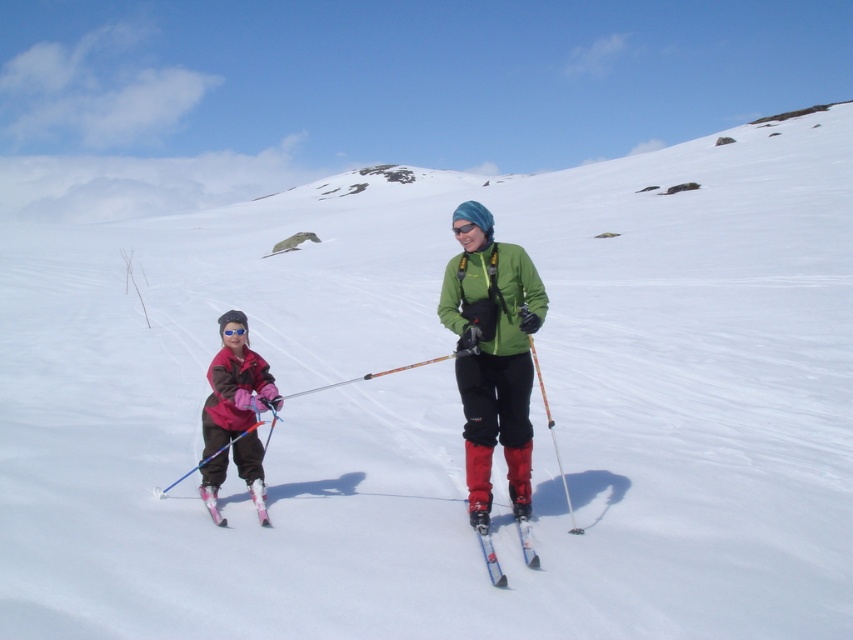
Does green matte jacket at center appear over metallic blue skis at center?

Indeed, green matte jacket at center is positioned over metallic blue skis at center.

How far apart are green matte jacket at center and metallic blue skis at center?

green matte jacket at center is 27.34 inches away from metallic blue skis at center.

Measure the distance between point (474, 260) and camera.

The distance of point (474, 260) from camera is 5.57 meters.

You are a GUI agent. You are given a task and a screenshot of the screen. Output one action in this format:
    pyautogui.click(x=<x>, y=<y>)
    Task: Click on the green matte jacket at center
    The height and width of the screenshot is (640, 853).
    Given the screenshot: What is the action you would take?
    pyautogui.click(x=492, y=353)

Which is in front, point (467, 236) or point (202, 422)?

Point (467, 236)

Measure the distance between green matte jacket at center and camera.

They are 17.11 feet apart.

Is point (502, 324) closer to viewer compared to point (256, 499)?

Yes, point (502, 324) is closer to viewer.

Where is `green matte jacket at center`? This screenshot has height=640, width=853. green matte jacket at center is located at coordinates (492, 353).

Which is in front, point (247, 422) or point (219, 518)?

Point (219, 518) is in front.

Identify the location of matte pink ski suit at left. The width and height of the screenshot is (853, 640). (233, 385).